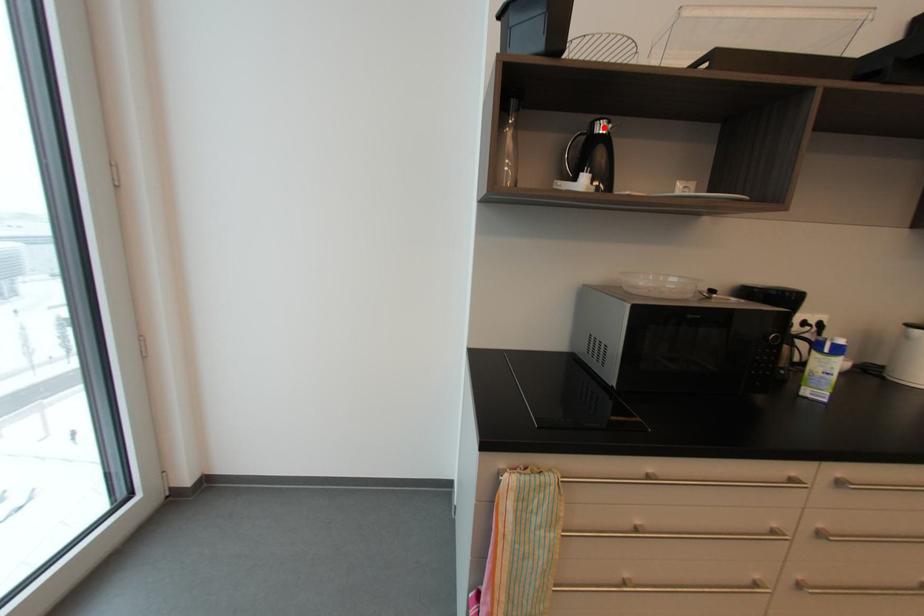
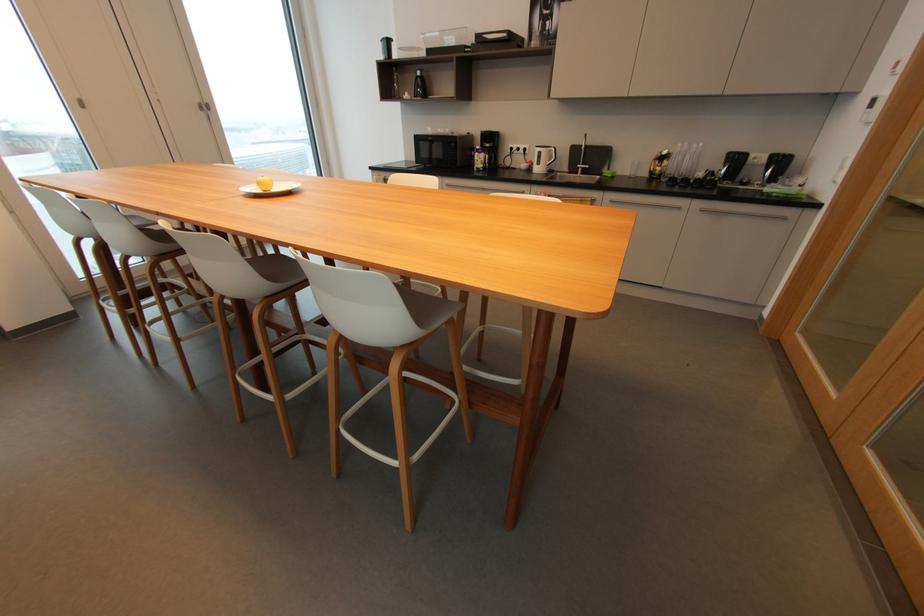
Question: I am providing you with two images of the same scene from different viewpoints. Given a red point in image1, look at the same physical point in image2. Is it:

Choices:
 (A) Closer to the viewpoint
 (B) Farther from the viewpoint

Answer: (A)